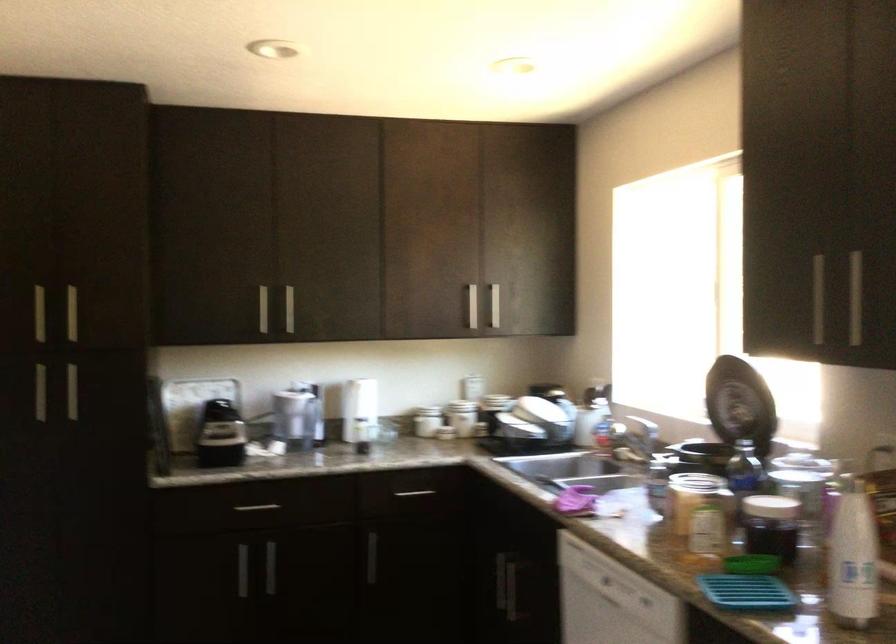
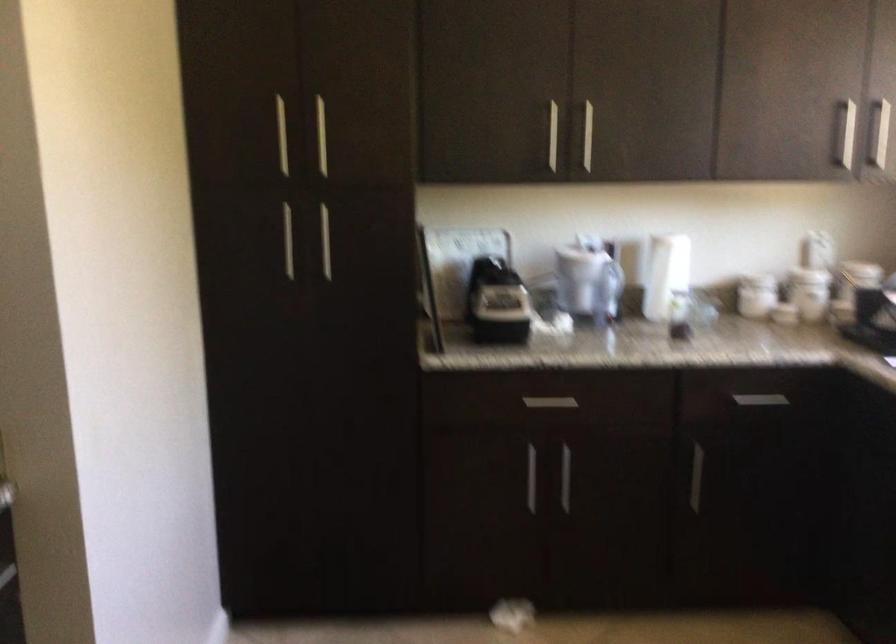
In the second image, find the point that corresponds to (288,308) in the first image.

(588, 136)